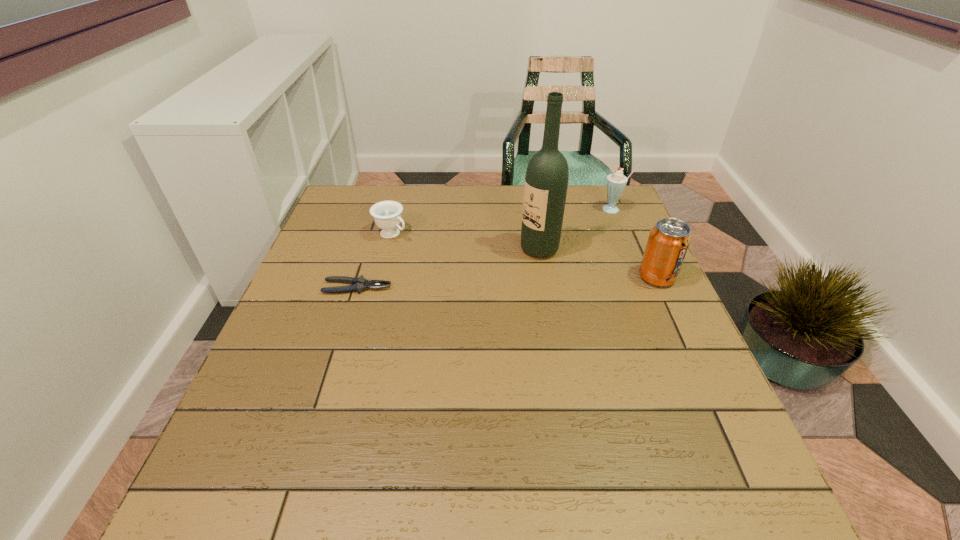
Find the location of a particular element. free region at the near left corner is located at coordinates (303, 434).

The height and width of the screenshot is (540, 960). I want to click on blank space at the far right corner of the desktop, so click(x=586, y=212).

I want to click on vacant space that's between the pliers and the farthest object, so click(486, 248).

Locate an element on the screen. vacant area that lies between the teacup and the milkshake is located at coordinates (503, 221).

The image size is (960, 540). What are the coordinates of `vacant region between the pliers and the teacup` in the screenshot? It's located at (374, 261).

Where is `unoccupied area between the second shortest object and the farthest object`? Image resolution: width=960 pixels, height=540 pixels. unoccupied area between the second shortest object and the farthest object is located at coordinates (503, 221).

Locate an element on the screen. This screenshot has width=960, height=540. free spot between the shortest object and the second shortest object is located at coordinates (374, 261).

What are the coordinates of `unoccupied position between the second shortest object and the farthest object` in the screenshot? It's located at (503, 221).

I want to click on blank region between the farthest object and the third object from right to left, so click(577, 229).

Where is `vacant point located between the wine bottle and the teacup`? This screenshot has height=540, width=960. vacant point located between the wine bottle and the teacup is located at coordinates (466, 241).